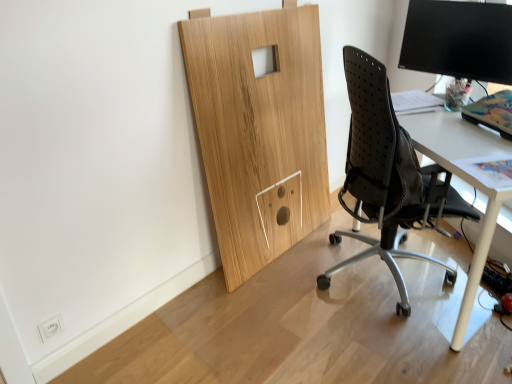
Question: Is the position of black mesh chair at right less distant than that of black glossy monitor at upper right?

Choices:
 (A) no
 (B) yes

Answer: (B)

Question: Is black mesh chair at right not inside black glossy monitor at upper right?

Choices:
 (A) yes
 (B) no

Answer: (A)

Question: Can black glossy monitor at upper right be found inside black mesh chair at right?

Choices:
 (A) no
 (B) yes

Answer: (A)

Question: Is black mesh chair at right positioned with its back to black glossy monitor at upper right?

Choices:
 (A) yes
 (B) no

Answer: (B)

Question: Considering the relative sizes of black mesh chair at right and black glossy monitor at upper right in the image provided, is black mesh chair at right taller than black glossy monitor at upper right?

Choices:
 (A) no
 (B) yes

Answer: (B)

Question: Looking at their shapes, would you say black mesh chair at right is wider or thinner than white glossy desk at right?

Choices:
 (A) thin
 (B) wide

Answer: (B)

Question: From a real-world perspective, is black mesh chair at right positioned above or below white glossy desk at right?

Choices:
 (A) below
 (B) above

Answer: (B)

Question: Would you say black mesh chair at right is inside or outside white glossy desk at right?

Choices:
 (A) inside
 (B) outside

Answer: (A)

Question: From the image's perspective, is black mesh chair at right located above or below white glossy desk at right?

Choices:
 (A) above
 (B) below

Answer: (A)

Question: Considering the positions of black glossy monitor at upper right and black mesh chair at right in the image, is black glossy monitor at upper right taller or shorter than black mesh chair at right?

Choices:
 (A) tall
 (B) short

Answer: (B)

Question: Is black glossy monitor at upper right situated inside black mesh chair at right or outside?

Choices:
 (A) outside
 (B) inside

Answer: (A)

Question: Is black glossy monitor at upper right in front of or behind black mesh chair at right in the image?

Choices:
 (A) behind
 (B) front

Answer: (A)

Question: Considering the positions of point (411, 4) and point (375, 142), is point (411, 4) closer or farther from the camera than point (375, 142)?

Choices:
 (A) farther
 (B) closer

Answer: (A)

Question: Relative to black glossy monitor at upper right, is black mesh chair at right in front or behind?

Choices:
 (A) behind
 (B) front

Answer: (B)

Question: In the image, is black mesh chair at right on the left side or the right side of black glossy monitor at upper right?

Choices:
 (A) left
 (B) right

Answer: (A)